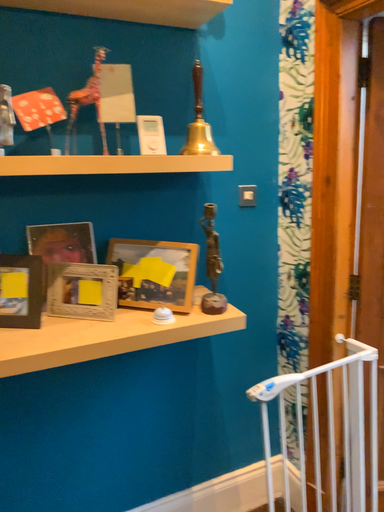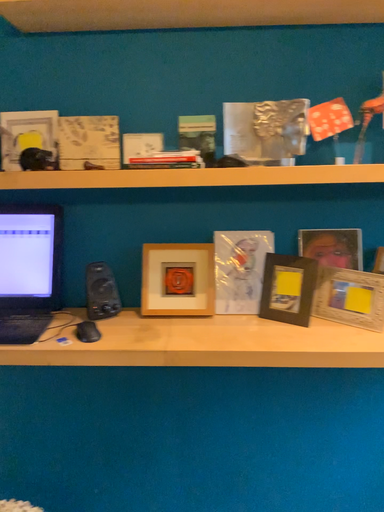
Question: How did the camera likely rotate when shooting the video?

Choices:
 (A) rotated left
 (B) rotated right

Answer: (A)